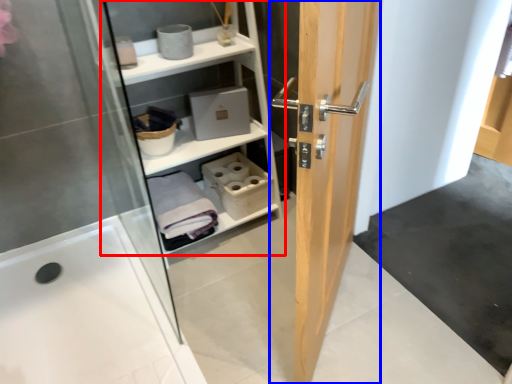
Question: Which object appears closest to the camera in this image, shelf (highlighted by a red box) or door (highlighted by a blue box)?

Choices:
 (A) shelf
 (B) door

Answer: (B)